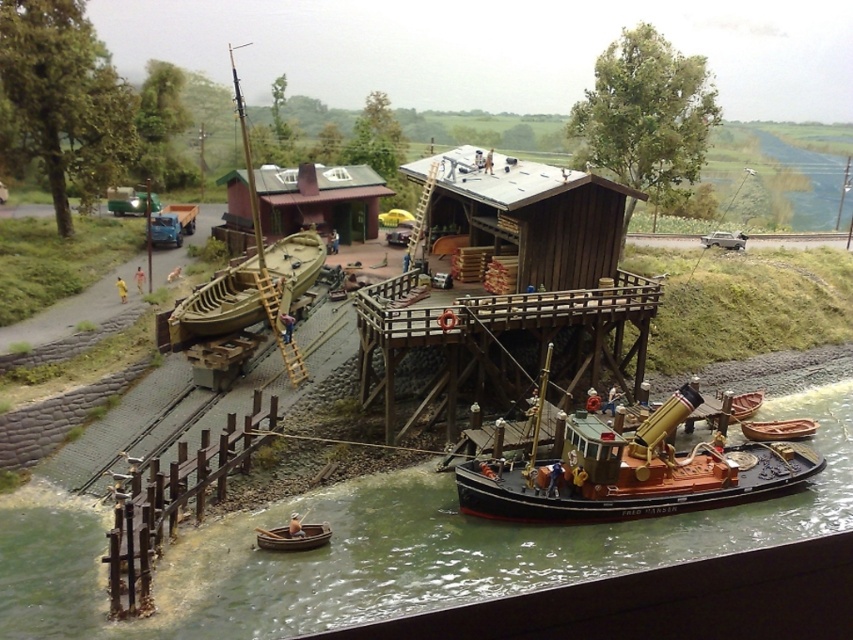
Question: Based on their relative distances, which object is farther from the wooden boat at lower right?

Choices:
 (A) wooden boat at center
 (B) greenish water at lower center
 (C) wooden polished tugboat at lower right
 (D) wooden boat at lower center

Answer: (A)

Question: Observing the image, what is the correct spatial positioning of wooden polished tugboat at lower right in reference to wooden boat at center?

Choices:
 (A) right
 (B) left

Answer: (A)

Question: Estimate the real-world distances between objects in this image. Which object is closer to the wooden boat at center?

Choices:
 (A) wooden polished tugboat at lower right
 (B) wooden boat at lower center
 (C) greenish water at lower center

Answer: (C)

Question: Considering the real-world distances, which object is farthest from the wooden boat at lower center?

Choices:
 (A) wooden boat at lower right
 (B) wooden polished tugboat at lower right
 (C) greenish water at lower center

Answer: (A)

Question: Is greenish water at lower center above wooden boat at center?

Choices:
 (A) no
 (B) yes

Answer: (A)

Question: Is wooden polished tugboat at lower right to the right of wooden boat at lower right from the viewer's perspective?

Choices:
 (A) yes
 (B) no

Answer: (B)